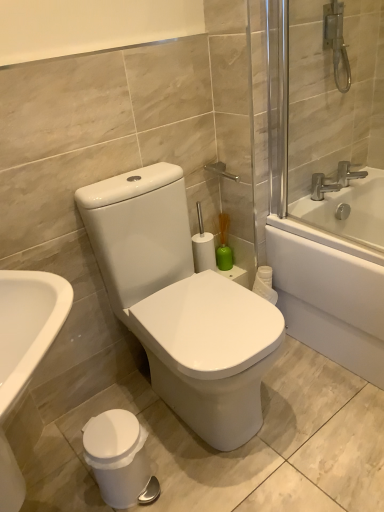
The width and height of the screenshot is (384, 512). I want to click on free space above white plastic trash can at lower left (from a real-world perspective), so click(109, 431).